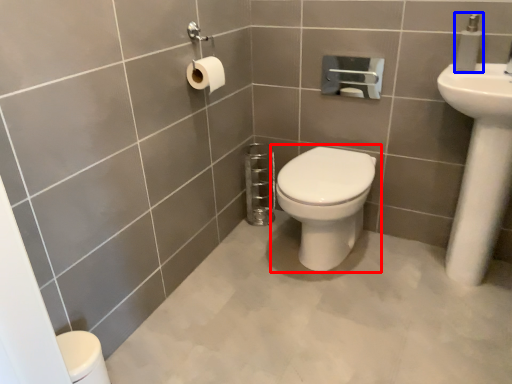
Question: Which of the following is the closest to the observer, toilet (highlighted by a red box) or soap dispenser (highlighted by a blue box)?

Choices:
 (A) toilet
 (B) soap dispenser

Answer: (B)